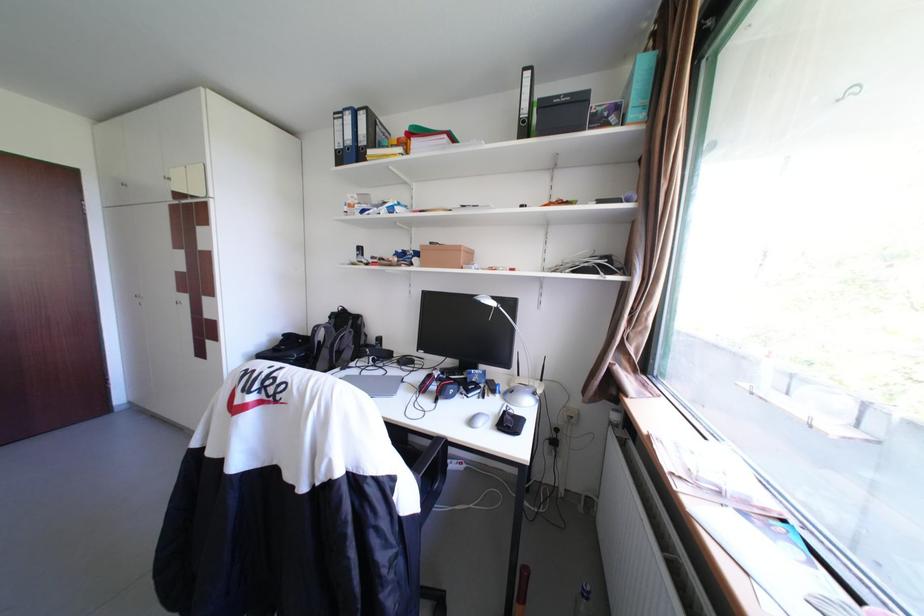
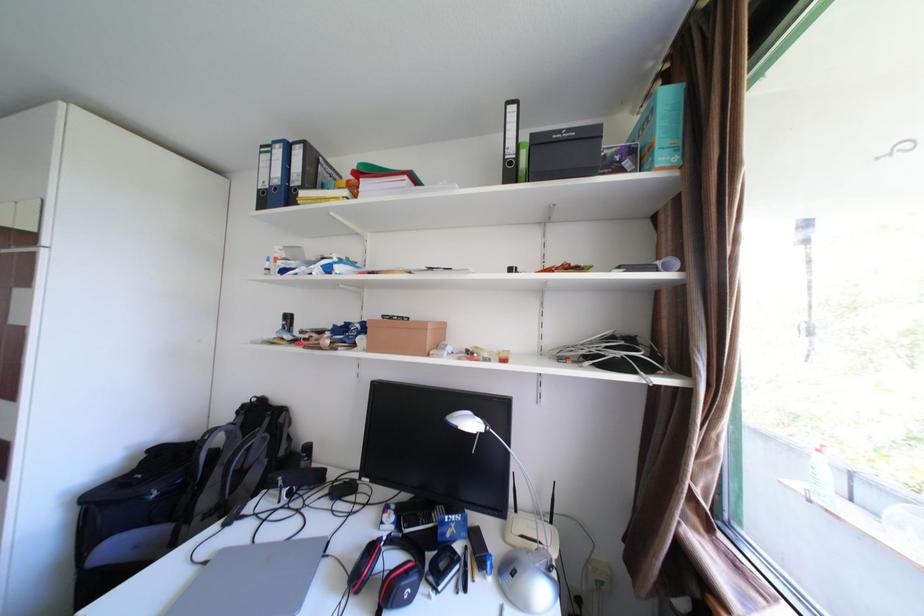
Question: Based on the continuous images, in which direction is the camera rotating? Reply with the corresponding letter.

Choices:
 (A) Left
 (B) Right
 (C) Up
 (D) Down

Answer: (C)